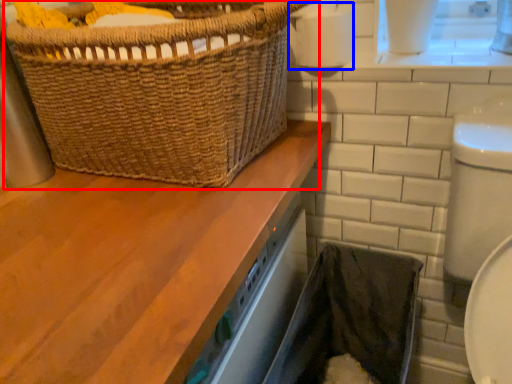
Question: Among these objects, which one is nearest to the camera, picnic basket (highlighted by a red box) or toilet paper (highlighted by a blue box)?

Choices:
 (A) picnic basket
 (B) toilet paper

Answer: (A)